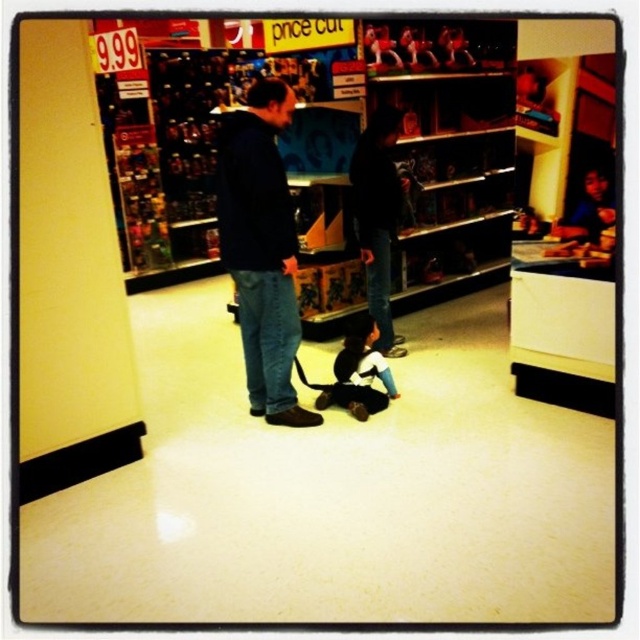
Looking at this image, you are a store employee organizing the shelves. You have a shelf that can only hold items wider than the soft plush bear at center. Can the matte pink plush at upper center fit on this shelf?

The soft plush bear at center might be wider than matte pink plush at upper center, so the matte pink plush at upper center may not be wide enough to fit on the shelf designed for items wider than the soft plush bear at center.

You are a customer in the store and want to place the soft plush bear at center on top of the matte pink plush at upper center. Is this possible based on their sizes?

The soft plush bear at center has a greater height compared to the matte pink plush at upper center. Therefore, placing the taller soft plush bear at center on top of the shorter matte pink plush at upper center may not be stable due to the height difference.

What is located at the point with coordinates [260,248] in the image?

The point at coordinates [260,248] marks the location of the dark blue hoodie at center.